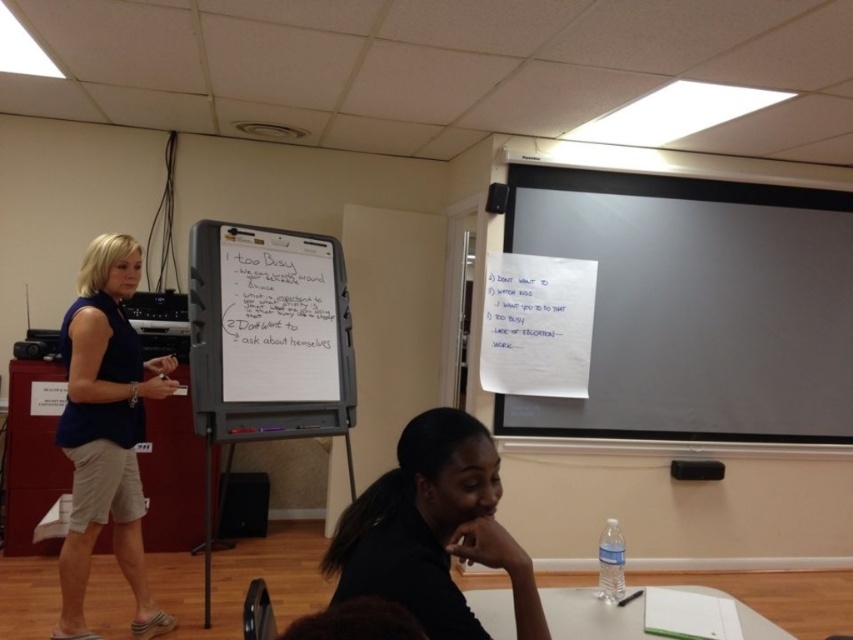
Looking at this image, is whiteboard at center positioned before blue cotton shirt at center?

No.

Does whiteboard at center have a lesser height compared to blue cotton shirt at center?

Correct, whiteboard at center is not as tall as blue cotton shirt at center.

Between point (252, 262) and point (84, 390), which one is positioned in front?

Point (84, 390) is in front.

Identify the location of whiteboard at center. The height and width of the screenshot is (640, 853). (268, 333).

Does black matte shirt at lower center have a greater width compared to white paper at lower center?

No, black matte shirt at lower center is not wider than white paper at lower center.

Is black matte shirt at lower center thinner than white paper at lower center?

Correct, black matte shirt at lower center's width is less than white paper at lower center's.

At what (x,y) coordinates should I click in order to perform the action: click on black matte shirt at lower center. Please return your answer as a coordinate pair (x, y). This screenshot has width=853, height=640. Looking at the image, I should click on (433, 531).

The height and width of the screenshot is (640, 853). I want to click on black matte shirt at lower center, so click(x=433, y=531).

Can you confirm if white matte projection screen at upper right is positioned to the left of black matte shirt at lower center?

Incorrect, white matte projection screen at upper right is not on the left side of black matte shirt at lower center.

Who is more forward, (819, 218) or (399, 444)?

Point (399, 444) is more forward.

This screenshot has width=853, height=640. I want to click on white matte projection screen at upper right, so coord(695,307).